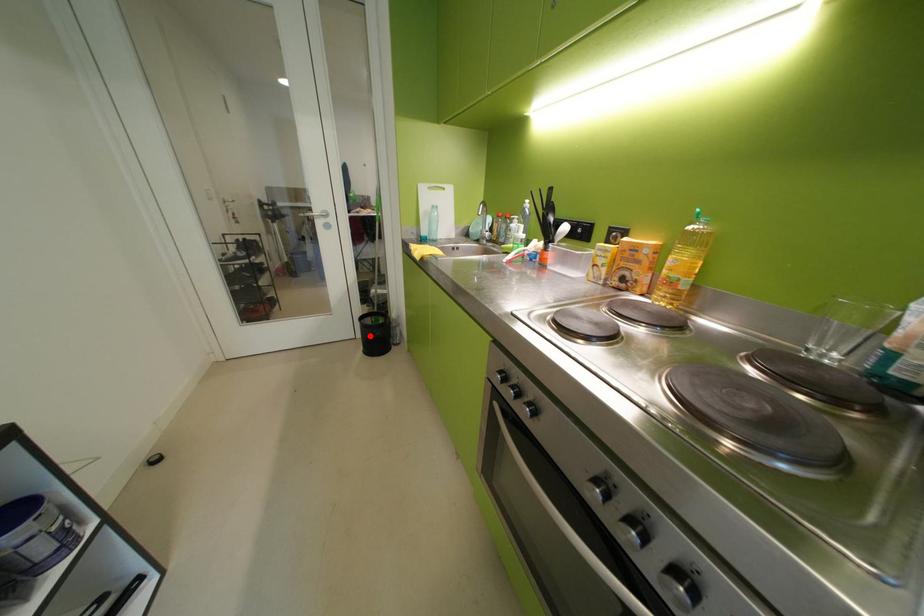
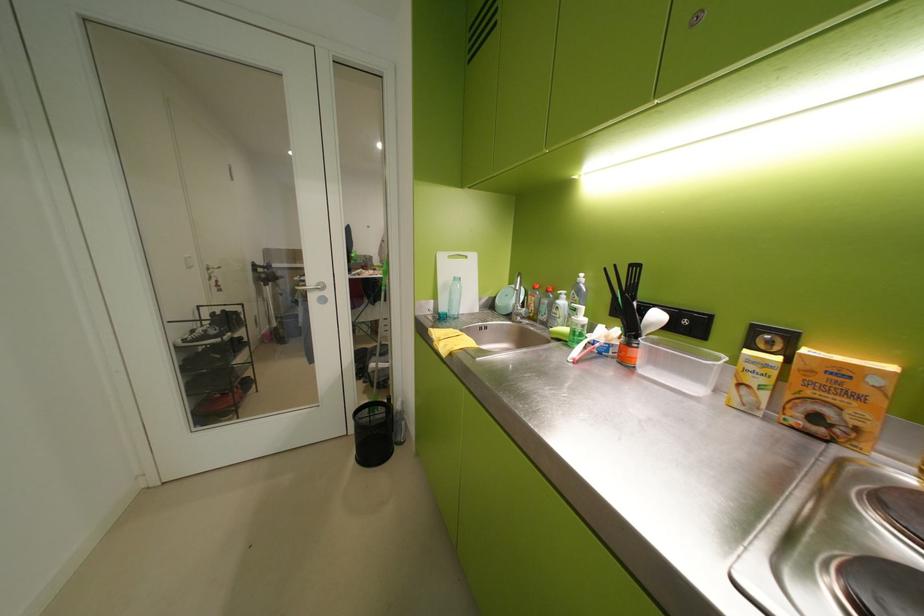
Question: I am providing you with two images of the same scene from different viewpoints. A red point is marked on the first image. Can you still see the location of the red point in image 2?

Choices:
 (A) Yes
 (B) No

Answer: (A)